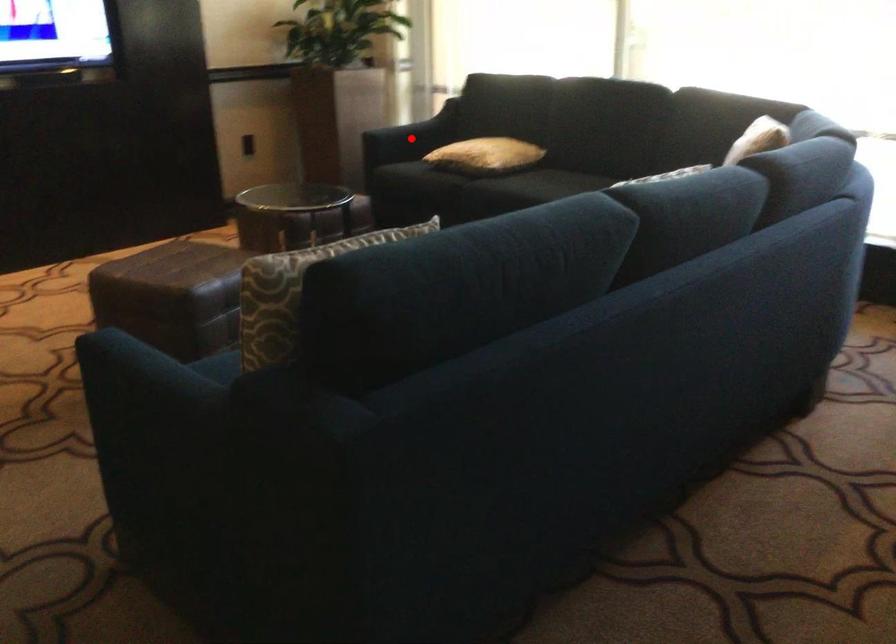
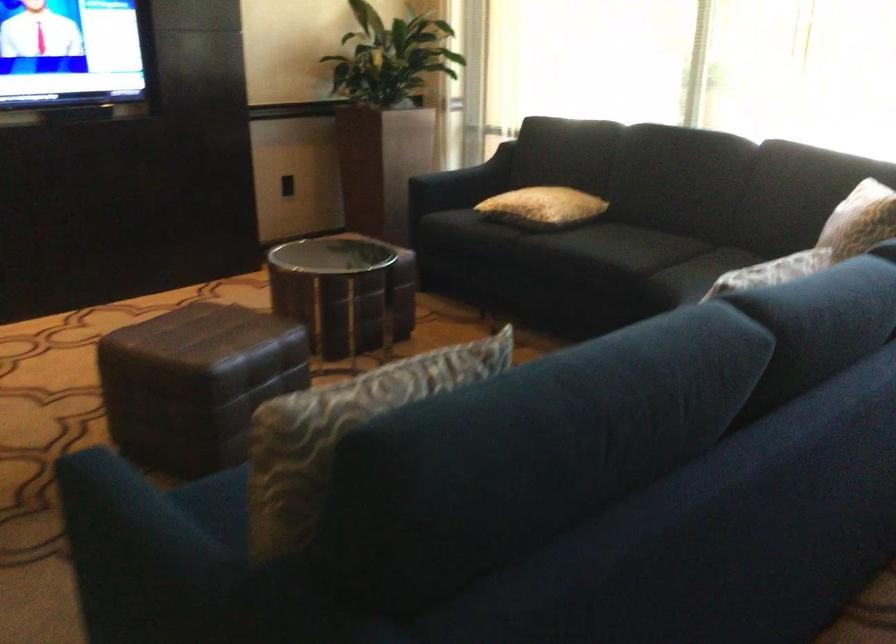
Find the pixel in the second image that matches the highlighted location in the first image.

(460, 184)